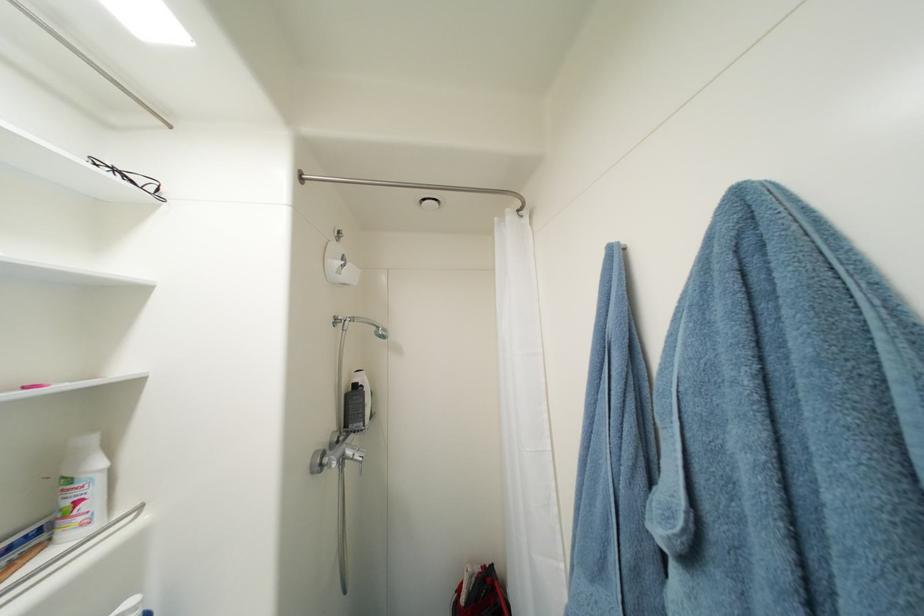
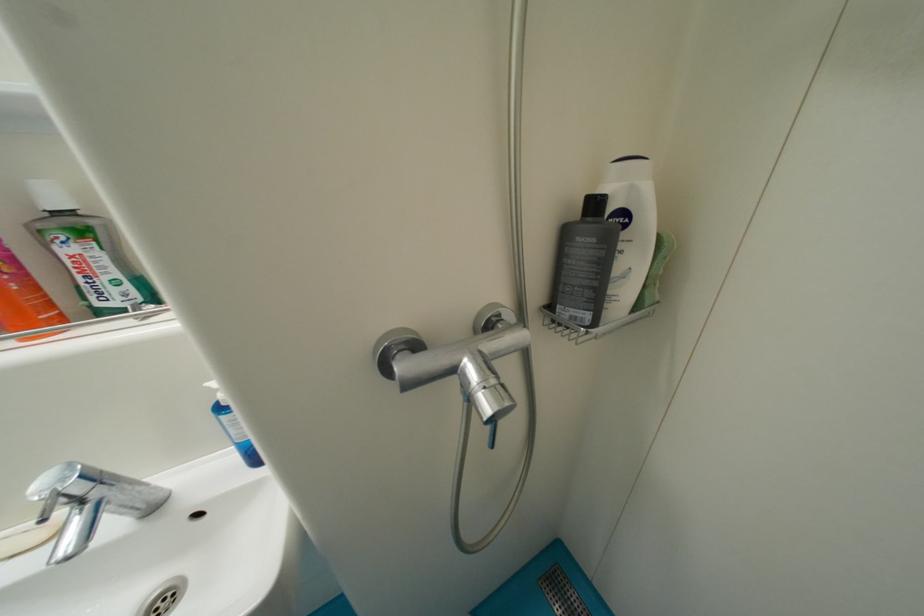
How did the camera likely rotate?

The camera's rotation is toward left-down.